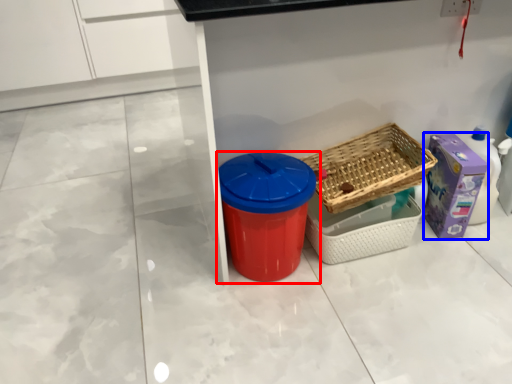
Question: Among these objects, which one is farthest to the camera, waste container (highlighted by a red box) or storage box (highlighted by a blue box)?

Choices:
 (A) waste container
 (B) storage box

Answer: (B)